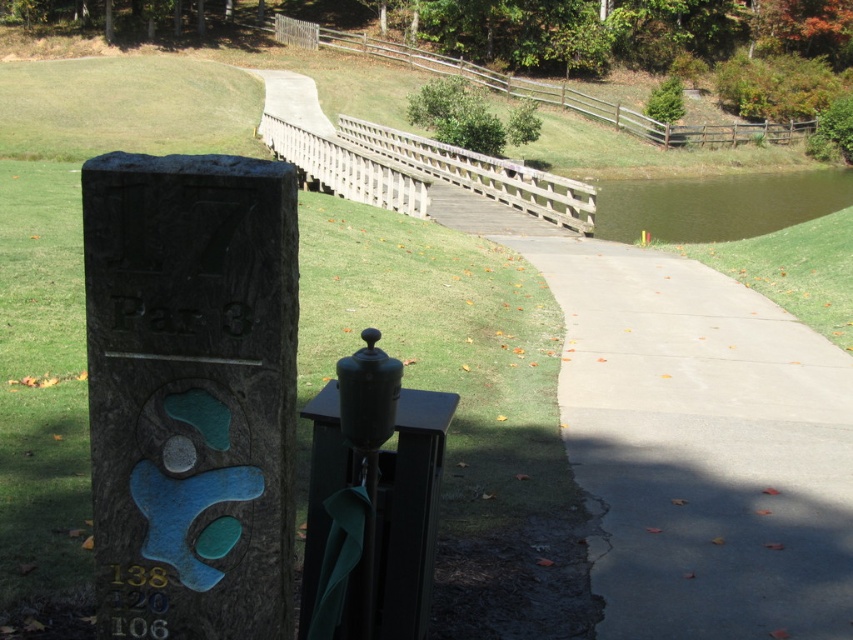
Who is shorter, bronze textured sign at left or wooden bridge at upper center?

With less height is bronze textured sign at left.

Is point (167, 280) closer to camera compared to point (462, 148)?

Yes.

Who is more forward, (276, 508) or (300, 164)?

Point (276, 508) is more forward.

Identify the location of bronze textured sign at left. This screenshot has width=853, height=640. (190, 394).

Is bronze textured sign at left shorter than greenish-brown water at lower right?

Indeed, bronze textured sign at left has a lesser height compared to greenish-brown water at lower right.

In the scene shown: Is bronze textured sign at left smaller than greenish-brown water at lower right?

Yes, bronze textured sign at left is smaller than greenish-brown water at lower right.

Which is in front, point (244, 381) or point (628, 236)?

Point (244, 381)

The height and width of the screenshot is (640, 853). I want to click on bronze textured sign at left, so (x=190, y=394).

Which is behind, point (515, 204) or point (837, 205)?

Positioned behind is point (837, 205).

Can you confirm if wooden bridge at upper center is shorter than greenish-brown water at lower right?

No.

Is point (587, 230) closer to camera compared to point (657, 234)?

Yes, point (587, 230) is closer to viewer.

The image size is (853, 640). I want to click on wooden bridge at upper center, so pos(404,161).